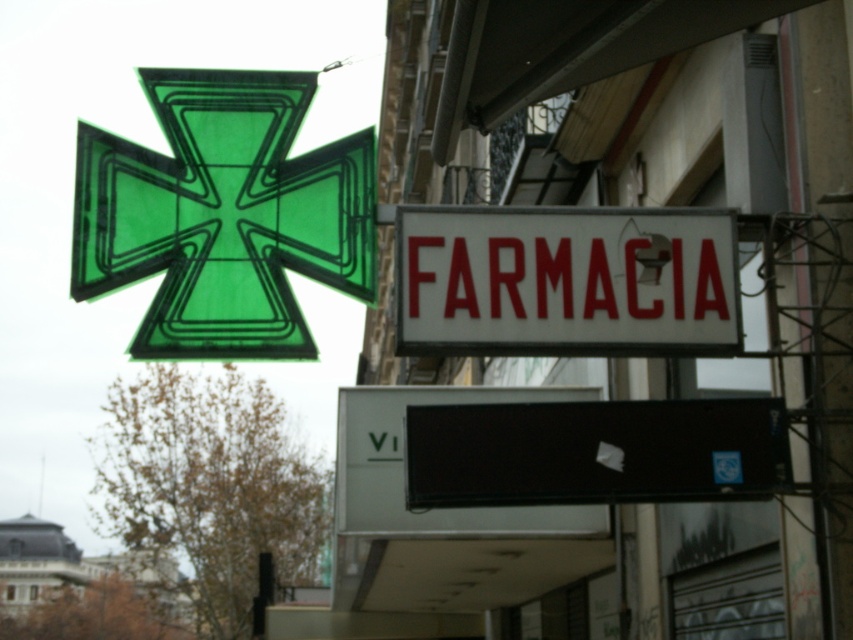
Question: Among these objects, which one is farthest from the camera?

Choices:
 (A) green matte cross at upper left
 (B) white matte signboard at center

Answer: (A)

Question: Which of the following is the farthest from the observer?

Choices:
 (A) (233, 250)
 (B) (424, 243)

Answer: (A)

Question: Can you confirm if green matte cross at upper left is smaller than white matte signboard at center?

Choices:
 (A) yes
 (B) no

Answer: (B)

Question: Is green matte cross at upper left wider than white matte signboard at center?

Choices:
 (A) no
 (B) yes

Answer: (A)

Question: Which object appears farthest from the camera in this image?

Choices:
 (A) green matte cross at upper left
 (B) white matte signboard at center

Answer: (A)

Question: Does green matte cross at upper left have a smaller size compared to white matte signboard at center?

Choices:
 (A) no
 (B) yes

Answer: (A)